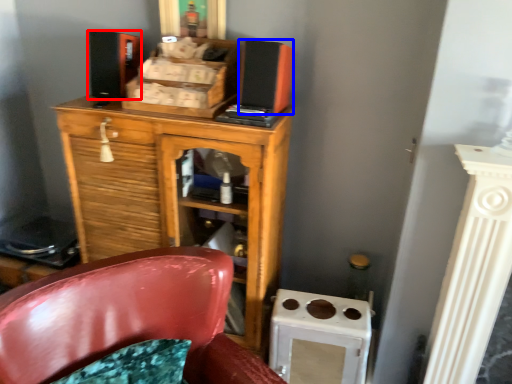
Question: Which object is further to the camera taking this photo, speaker (highlighted by a red box) or speaker (highlighted by a blue box)?

Choices:
 (A) speaker
 (B) speaker

Answer: (A)